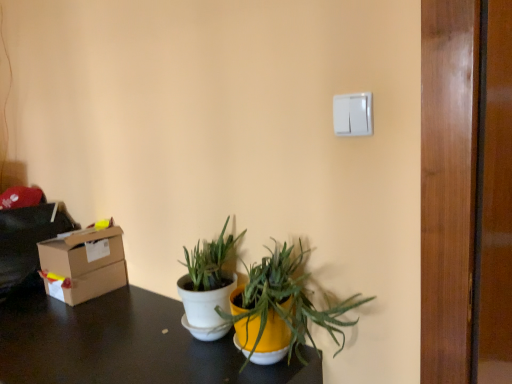
Locate an element on the screen. This screenshot has width=512, height=384. vacant space to the right of cardboard box at left is located at coordinates [x=119, y=302].